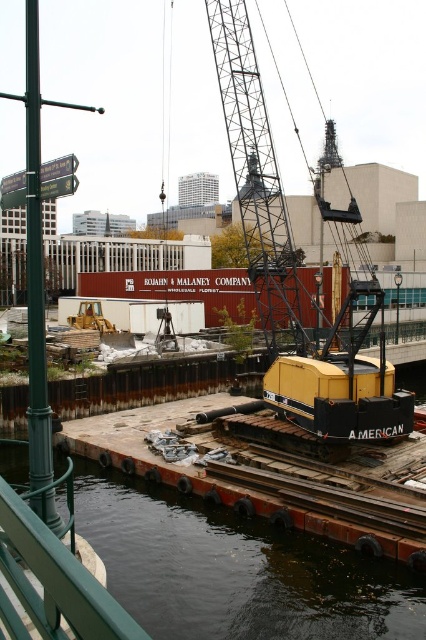
Question: Which of the following is the farthest from the observer?

Choices:
 (A) (183, 499)
 (B) (330, 339)

Answer: (B)

Question: Is dark water at lower left above yellow metallic crane at center?

Choices:
 (A) yes
 (B) no

Answer: (B)

Question: Is dark water at lower left to the right of yellow metallic crane at center from the viewer's perspective?

Choices:
 (A) no
 (B) yes

Answer: (A)

Question: Which point is closer to the camera?

Choices:
 (A) (302, 602)
 (B) (340, 236)

Answer: (A)

Question: Observing the image, what is the correct spatial positioning of dark water at lower left in reference to yellow metallic crane at center?

Choices:
 (A) below
 (B) above

Answer: (A)

Question: Which of the following is the closest to the observer?

Choices:
 (A) (155, 500)
 (B) (307, 424)

Answer: (B)